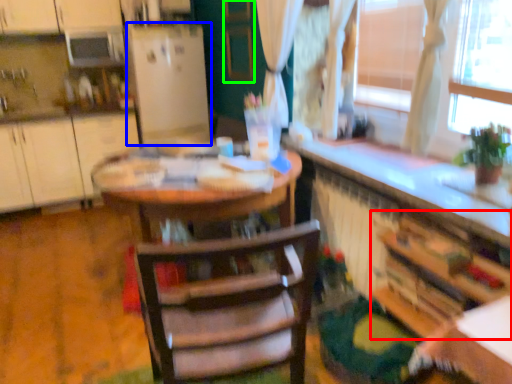
Question: Which is farther away from cabinetry (highlighted by a red box)? fridge (highlighted by a blue box) or screen door (highlighted by a green box)?

Choices:
 (A) fridge
 (B) screen door

Answer: (A)